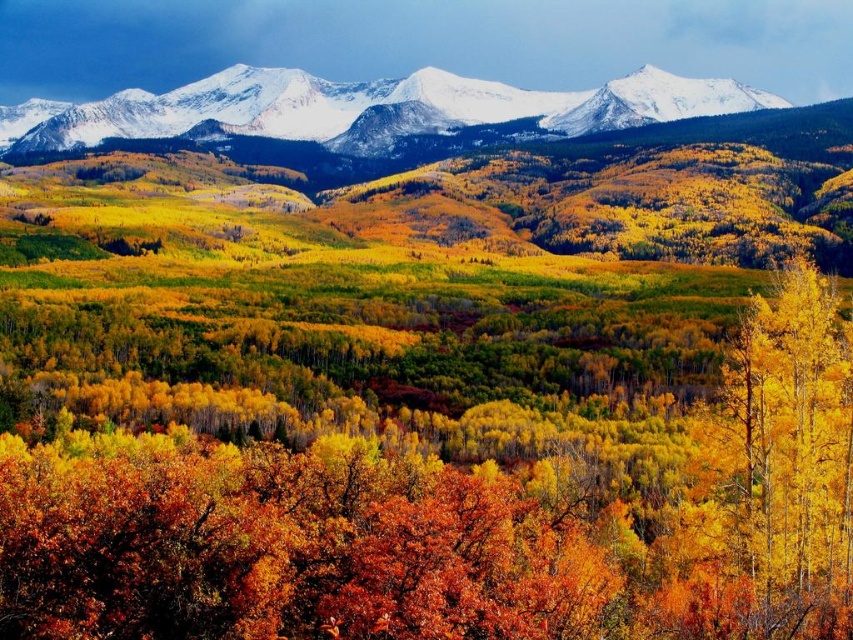
Question: Is yellow smooth tree at right to the right of snowy white mountains at upper center from the viewer's perspective?

Choices:
 (A) no
 (B) yes

Answer: (B)

Question: Among these objects, which one is nearest to the camera?

Choices:
 (A) snowy white mountains at upper center
 (B) yellow smooth tree at right

Answer: (B)

Question: Which point is farther to the camera?

Choices:
 (A) snowy white mountains at upper center
 (B) yellow smooth tree at right

Answer: (A)

Question: Is yellow smooth tree at right wider than snowy white mountains at upper center?

Choices:
 (A) yes
 (B) no

Answer: (B)

Question: Is yellow smooth tree at right bigger than snowy white mountains at upper center?

Choices:
 (A) no
 (B) yes

Answer: (B)